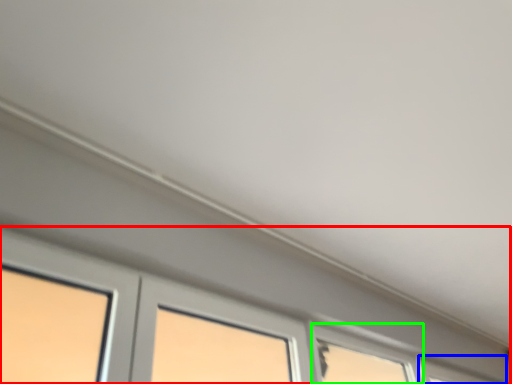
Question: Which object is the closest to the window (highlighted by a red box)? Choose among these: window (highlighted by a blue box) or window (highlighted by a green box).

Choices:
 (A) window
 (B) window

Answer: (A)